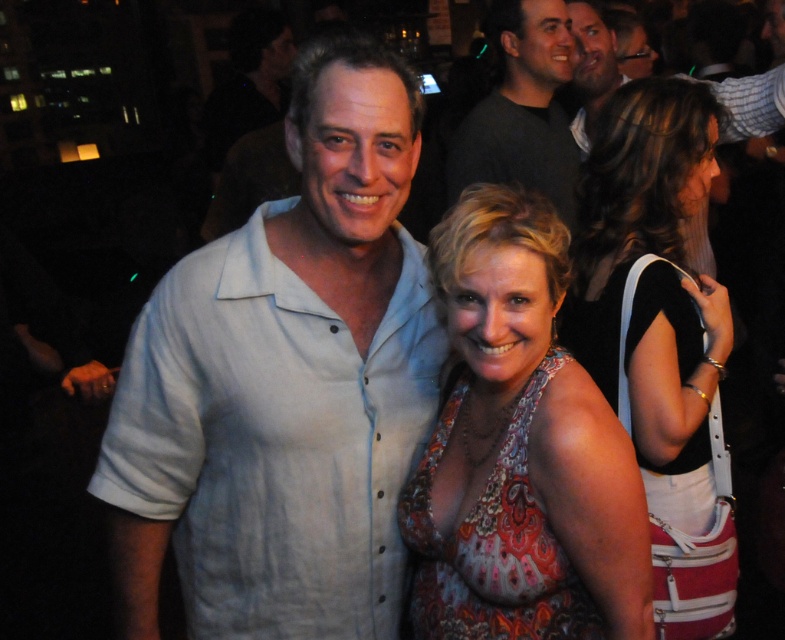
Between point (535, 260) and point (539, 3), which one is positioned in front?

Point (535, 260) is in front.

Describe the element at coordinates (520, 451) in the screenshot. I see `floral-patterned dress at center` at that location.

Where is `floral-patterned dress at center`? This screenshot has width=785, height=640. floral-patterned dress at center is located at coordinates 520,451.

Can you confirm if light blue linen shirt at center is bigger than black leather purse at right?

Indeed, light blue linen shirt at center has a larger size compared to black leather purse at right.

Who is shorter, light blue linen shirt at center or black leather purse at right?

With less height is light blue linen shirt at center.

Measure the distance between point (188,413) and camera.

The distance of point (188,413) from camera is 1.19 meters.

Where is `light blue linen shirt at center`? Image resolution: width=785 pixels, height=640 pixels. light blue linen shirt at center is located at coordinates (285, 384).

Does floral-patterned dress at center appear under black leather purse at right?

Correct, floral-patterned dress at center is located below black leather purse at right.

Between floral-patterned dress at center and black leather purse at right, which one is positioned higher?

black leather purse at right is above.

Is point (502, 257) positioned in front of point (632, 182)?

Yes, it is.

This screenshot has height=640, width=785. In order to click on floral-patterned dress at center in this screenshot , I will do `click(520, 451)`.